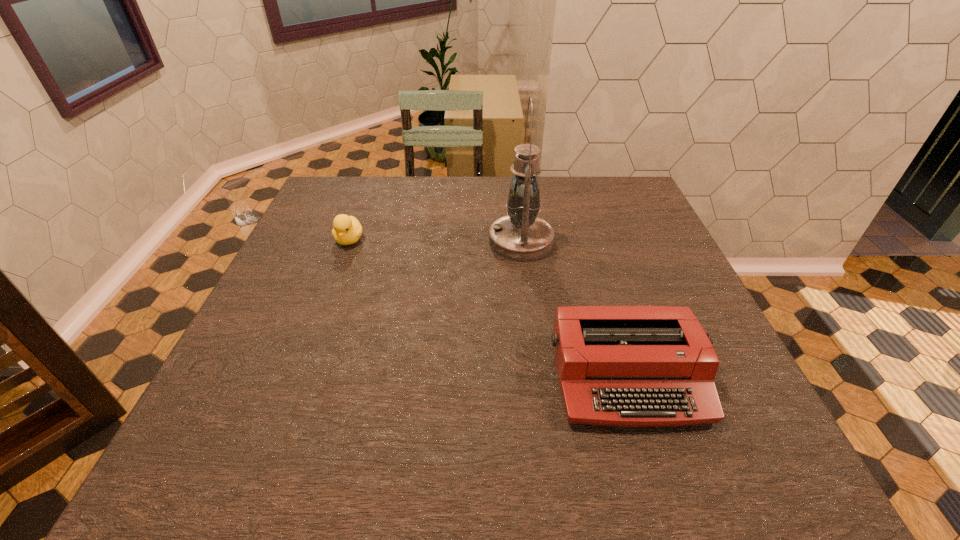
Locate an element on the screen. Image resolution: width=960 pixels, height=540 pixels. free space at the far left corner is located at coordinates (362, 193).

Where is `vacant space at the near right corner`? This screenshot has height=540, width=960. vacant space at the near right corner is located at coordinates (715, 467).

Image resolution: width=960 pixels, height=540 pixels. I want to click on vacant space that's between the leftmost object and the typewriter, so click(489, 309).

What are the coordinates of `empty location between the oil lamp and the duck` in the screenshot? It's located at pyautogui.click(x=435, y=241).

This screenshot has height=540, width=960. In order to click on vacant space in between the typewriter and the duck in this screenshot , I will do `click(489, 309)`.

What are the coordinates of `vacant space in between the duck and the typewriter` in the screenshot? It's located at (489, 309).

Find the location of a particular element. The width and height of the screenshot is (960, 540). empty location between the leftmost object and the tallest object is located at coordinates (435, 241).

Identify which object is the second nearest to the duck. Please provide its 2D coordinates. Your answer should be formatted as a tuple, i.e. [(x, y)], where the tuple contains the x and y coordinates of a point satisfying the conditions above.

[(633, 366)]

Identify which object is the nearest to the leftmost object. Please provide its 2D coordinates. Your answer should be formatted as a tuple, i.e. [(x, y)], where the tuple contains the x and y coordinates of a point satisfying the conditions above.

[(521, 236)]

At what (x,y) coordinates should I click in order to perform the action: click on free region that satisfies the following two spatial constraints: 1. on the front-facing side of the duck; 2. on the left side of the tallest object. Please return your answer as a coordinate pair (x, y). This screenshot has height=540, width=960. Looking at the image, I should click on (348, 241).